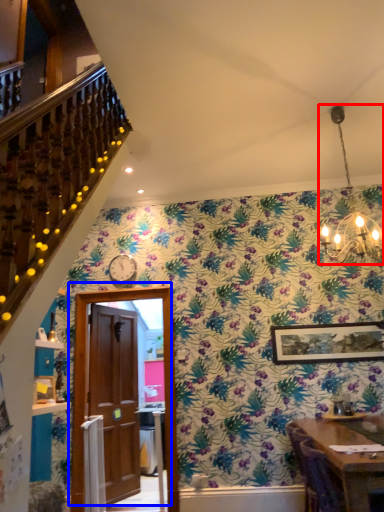
Question: Which point is further to the camera, light fixture (highlighted by a red box) or door (highlighted by a blue box)?

Choices:
 (A) light fixture
 (B) door

Answer: (B)